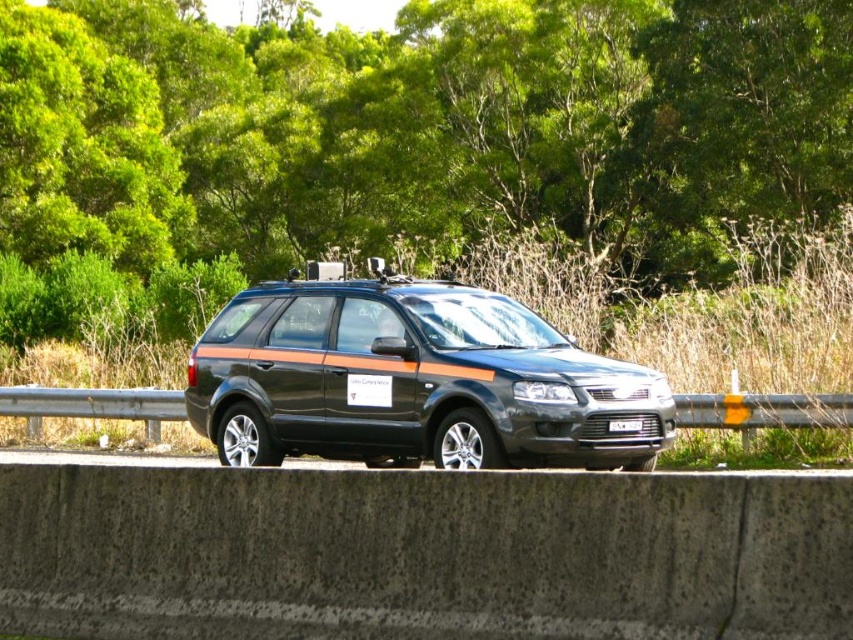
Question: Which object is farther from the camera taking this photo?

Choices:
 (A) black plastic license plate at center
 (B) concrete at center

Answer: (A)

Question: Is green leafy tree at center to the right of matte black minivan at center from the viewer's perspective?

Choices:
 (A) no
 (B) yes

Answer: (A)

Question: Can you confirm if matte black minivan at center is wider than black plastic license plate at center?

Choices:
 (A) no
 (B) yes

Answer: (B)

Question: Can you confirm if concrete at center is positioned above matte black minivan at center?

Choices:
 (A) yes
 (B) no

Answer: (B)

Question: Which object is the farthest from the black plastic license plate at center?

Choices:
 (A) concrete at center
 (B) green leafy tree at center

Answer: (B)

Question: Which object is closer to the camera taking this photo?

Choices:
 (A) green leafy tree at center
 (B) concrete at center
 (C) matte black minivan at center

Answer: (B)